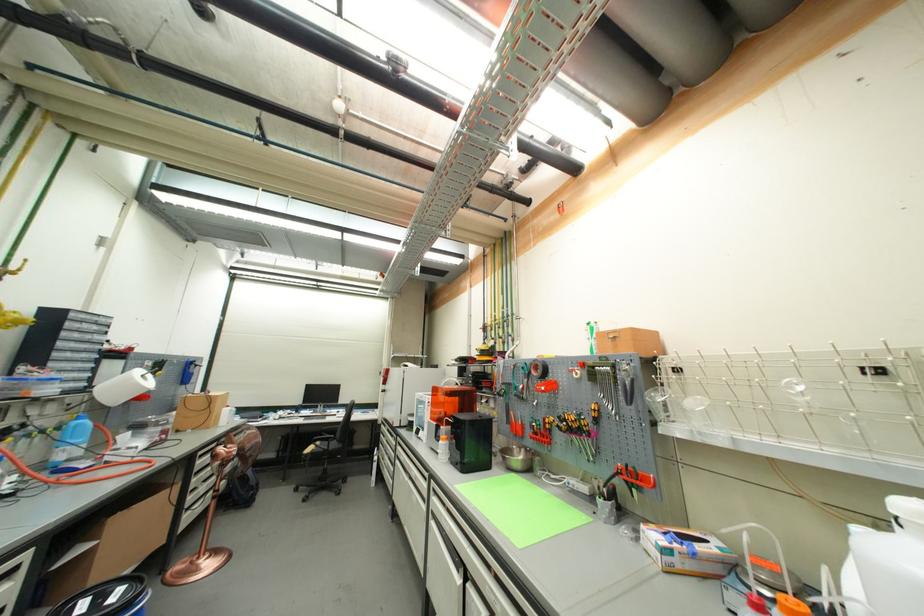
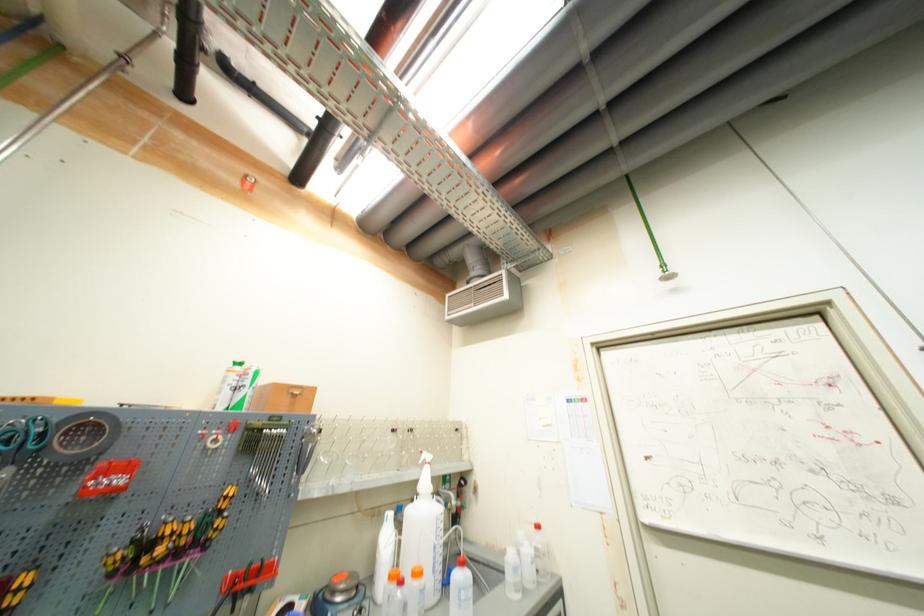
Find the pixel in the second image that matches pixel 906 528 in the first image.

(420, 501)